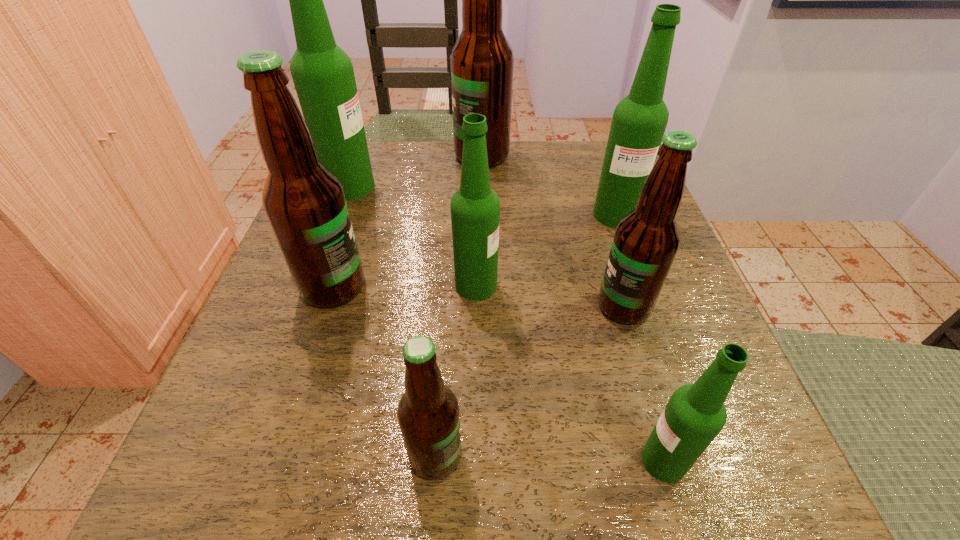
This screenshot has width=960, height=540. Find the location of `vacant space at the left edge of the desktop`. vacant space at the left edge of the desktop is located at coordinates (366, 218).

Find the location of a particular element. vacant space at the right edge is located at coordinates (661, 352).

Locate an element on the screen. blank space at the far left corner of the desktop is located at coordinates (389, 186).

This screenshot has height=540, width=960. In the image, there is a desktop. What are the coordinates of `free space at the near left corner` in the screenshot? It's located at (259, 501).

Find the location of a particular element. vacant space at the far right corner of the desktop is located at coordinates (591, 147).

This screenshot has width=960, height=540. I want to click on vacant area at the near right corner of the desktop, so click(770, 482).

Identify the location of free space between the second green beer bottle from left to right and the second biggest green beer bottle. (545, 250).

You are a GUI agent. You are given a task and a screenshot of the screen. Output one action in this format:
    pyautogui.click(x=<x>, y=<y>)
    Task: Click on the empty location between the nearest green beer bottle and the second biggest brown beer bottle
    Image resolution: width=960 pixels, height=540 pixels.
    Given the screenshot: What is the action you would take?
    pyautogui.click(x=498, y=374)

Locate an element on the screen. The image size is (960, 540). vacant space that's between the third green beer bottle from right to left and the rightmost brown beer bottle is located at coordinates (550, 296).

Identify the location of free space that is in between the nearest green beer bottle and the smallest brown beer bottle. (549, 458).